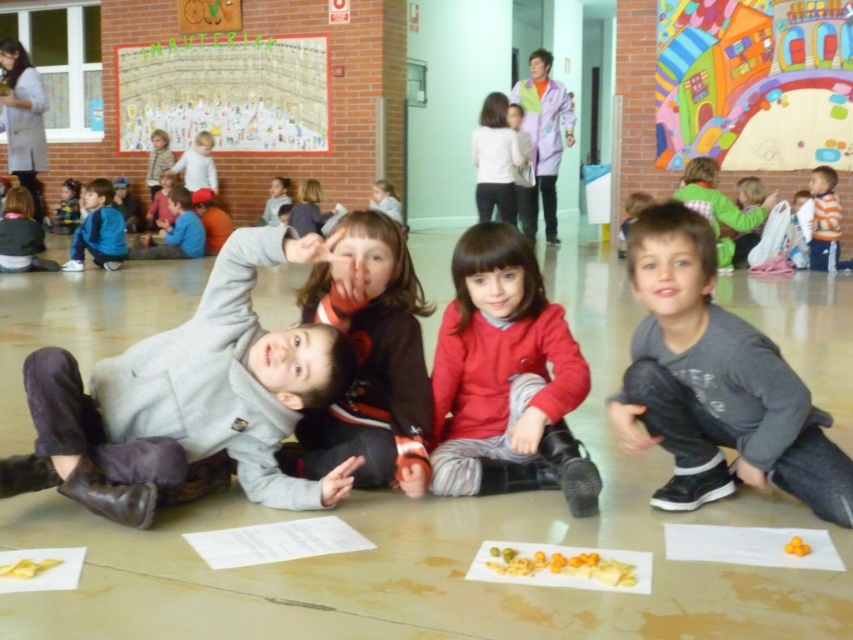
Is red cotton shirt at center positioned in front of dark brown sweater at center?

Yes, red cotton shirt at center is closer to the viewer.

Who is positioned more to the left, red cotton shirt at center or dark brown sweater at center?

dark brown sweater at center is more to the left.

This screenshot has height=640, width=853. Describe the element at coordinates (506, 378) in the screenshot. I see `red cotton shirt at center` at that location.

Identify the location of red cotton shirt at center. (506, 378).

Can you confirm if matte gray hoodie at upper right is positioned to the left of white cotton shirt at upper left?

No, matte gray hoodie at upper right is not to the left of white cotton shirt at upper left.

Between matte gray hoodie at upper right and white cotton shirt at upper left, which one appears on the right side from the viewer's perspective?

From the viewer's perspective, matte gray hoodie at upper right appears more on the right side.

Measure the distance between point (x=718, y=208) and camera.

Point (x=718, y=208) is 7.24 meters from camera.

Identify the location of matte gray hoodie at upper right. (718, 205).

Which is behind, point (347, 461) or point (599, 582)?

Point (347, 461)

I want to click on gray wool sweater at center, so click(193, 396).

Where is `gray wool sweater at center`? The image size is (853, 640). gray wool sweater at center is located at coordinates (193, 396).